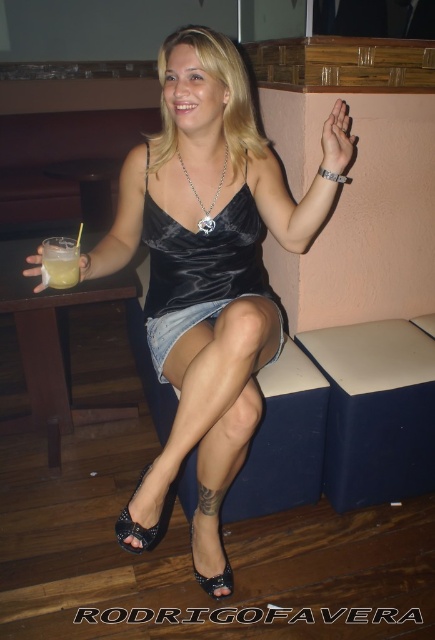
You are a fashion designer observing a woman in a bar setting. You notice the satin dress at center and the black satin sandal at lower center. Which item is positioned higher on her body?

The satin dress at center is above the black satin sandal at lower center, so the satin dress at center is positioned higher on her body.

You are a photographer trying to capture the woman in the scene. If you focus on the satin dress at center, will the black satin sandal at lower center also be in focus? Explain why based on their positions.

The satin dress at center is closer to the viewer than the black satin sandal at lower center. Since the dress is in focus, the sandal, being further away, may not be in focus depending on the camera settings. However, in most cases, objects at different distances can be in focus simultaneously if the depth of field is sufficient. Without specific camera details, it is uncertain.